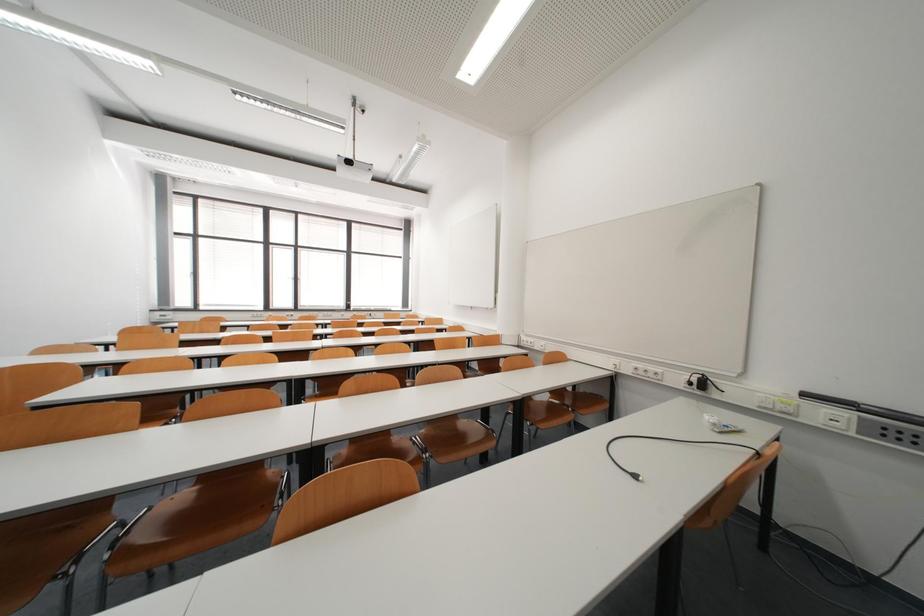
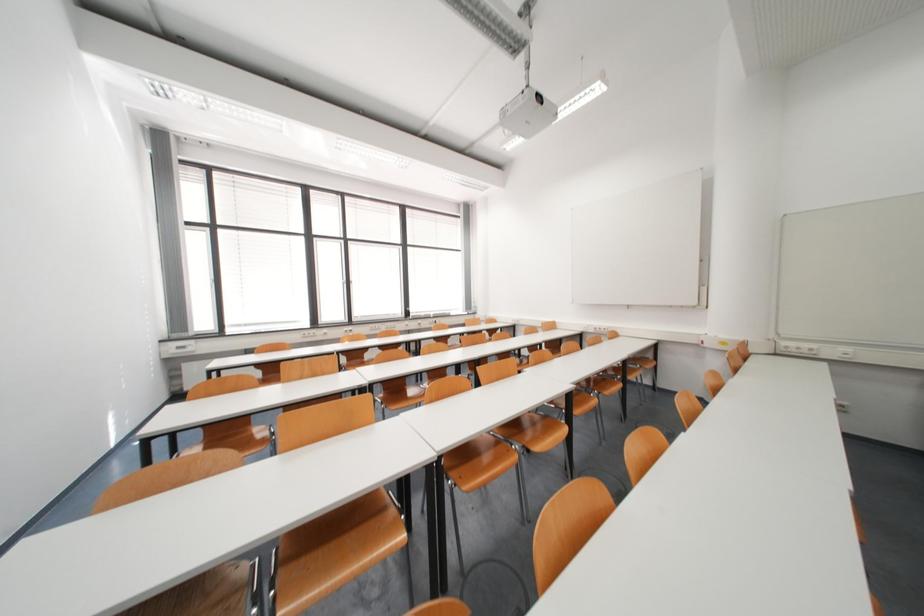
In a continuous first-person perspective shot, in which direction is the camera moving?

The cameraman moved toward left, forward.